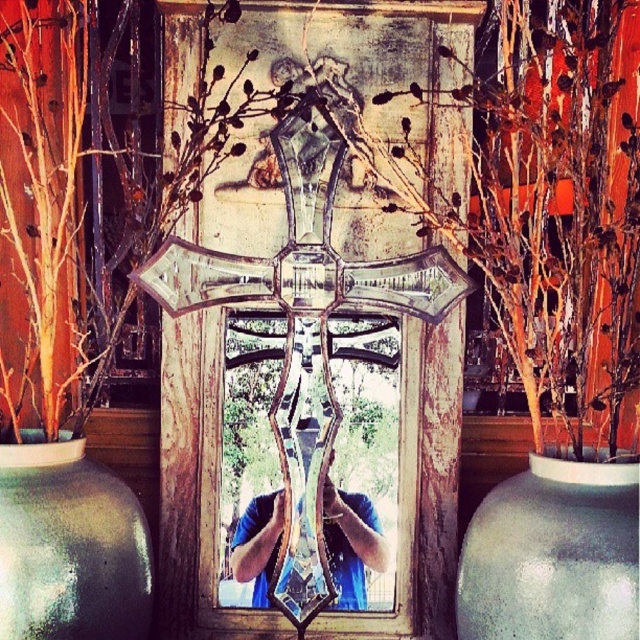
You are standing in front of the rustic mirror and want to place a decorative item at point (291, 256) and point (70, 556). Which point is closer to you?

Point (70, 556) is closer to you because it is in front of point (291, 256).